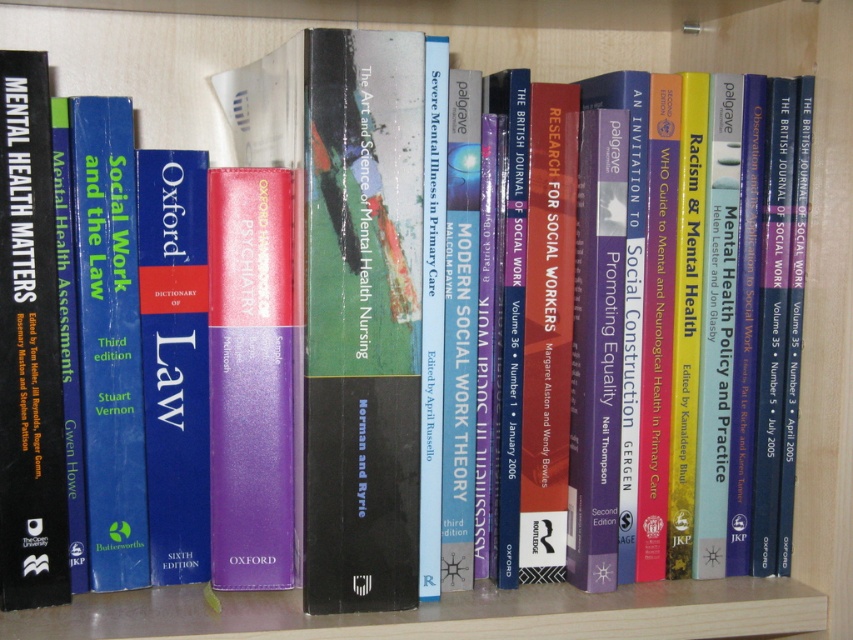
Question: Estimate the real-world distances between objects in this image. Which object is closer to the black matte book at left?

Choices:
 (A) hardcover book at center
 (B) blue hardcover book at left

Answer: (B)

Question: Can you confirm if purple hardcover book at center is bigger than blue hardcover dictionary of law at center?

Choices:
 (A) yes
 (B) no

Answer: (A)

Question: Observing the image, what is the correct spatial positioning of black matte book at left in reference to blue hardcover book at left?

Choices:
 (A) left
 (B) right

Answer: (A)

Question: Which of the following is the farthest from the observer?

Choices:
 (A) purple hardcover book at center
 (B) blue hardcover book at left
 (C) hardcover book at center

Answer: (A)

Question: Where is hardcover book at center located in relation to blue hardcover book at left in the image?

Choices:
 (A) above
 (B) below

Answer: (A)

Question: Which object is positioned closest to the purple hardcover book at center?

Choices:
 (A) blue hardcover dictionary of law at center
 (B) blue hardcover book at left
 (C) hardcover book at center
 (D) black matte book at left

Answer: (A)